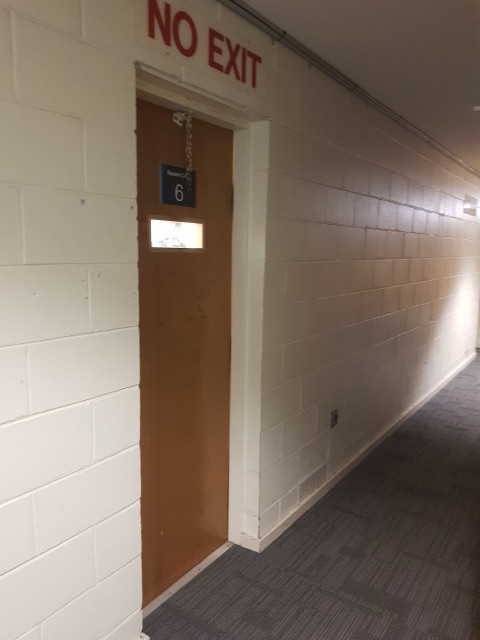
Locate an element on the screen. The image size is (480, 640). wall is located at coordinates (365, 268).